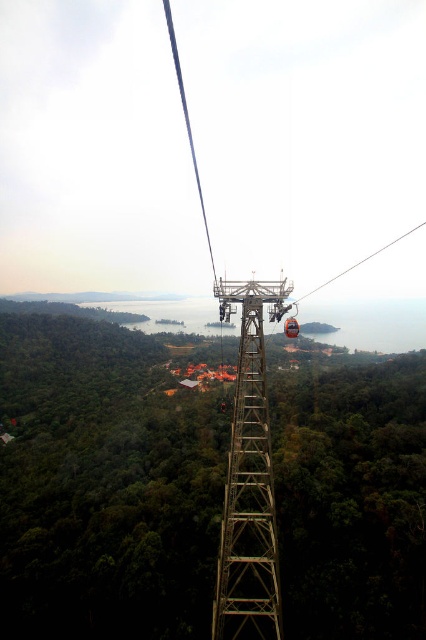
Question: Can you confirm if metallic structure at center is smaller than blue wire at center?

Choices:
 (A) yes
 (B) no

Answer: (A)

Question: Does metallic structure at center appear on the right side of metallic cable car at center?

Choices:
 (A) no
 (B) yes

Answer: (A)

Question: Which point is closer to the camera taking this photo?

Choices:
 (A) (244, 417)
 (B) (187, 122)
 (C) (374, 256)

Answer: (A)

Question: Which object appears farthest from the camera in this image?

Choices:
 (A) blue wire at center
 (B) orange matte ski lift at center
 (C) metallic cable car at center
 (D) metallic structure at center

Answer: (B)

Question: Can you confirm if metallic structure at center is thinner than blue wire at center?

Choices:
 (A) yes
 (B) no

Answer: (A)

Question: Among these objects, which one is nearest to the camera?

Choices:
 (A) orange matte ski lift at center
 (B) blue wire at center
 (C) metallic cable car at center

Answer: (B)